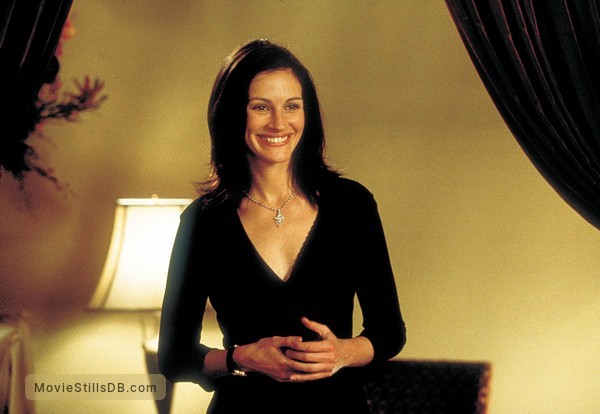
Find the location of `lamp shade`. lamp shade is located at coordinates (x=145, y=258).